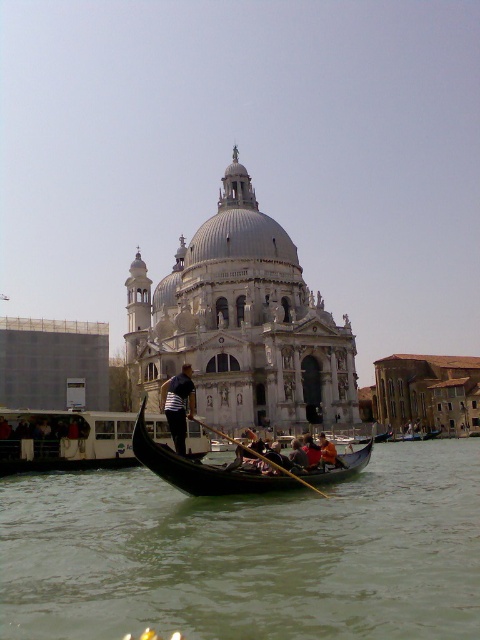
Is striped shirt at center below wooden gondola at center?

No.

Who is positioned more to the right, striped shirt at center or wooden gondola at center?

From the viewer's perspective, wooden gondola at center appears more on the right side.

Which is behind, point (180, 412) or point (423, 438)?

The point (423, 438) is behind.

This screenshot has height=640, width=480. What are the coordinates of `striped shirt at center` in the screenshot? It's located at (179, 404).

Does greenish water at gondola center appear over white marble cathedral at center?

Actually, greenish water at gondola center is below white marble cathedral at center.

Is greenish water at gondola center smaller than white marble cathedral at center?

Yes.

Which is in front, point (165, 577) or point (291, 243)?

Point (165, 577)

Image resolution: width=480 pixels, height=640 pixels. Find the location of `greenish water at gondola center`. greenish water at gondola center is located at coordinates (248, 554).

Is greenish water at gondola center smaller than striped shirt at center?

Incorrect, greenish water at gondola center is not smaller in size than striped shirt at center.

Is point (351, 540) closer to viewer compared to point (182, 442)?

That is True.

Is point (381, 554) closer to camera compared to point (164, 401)?

Yes, it is.

This screenshot has height=640, width=480. What are the coordinates of `greenish water at gondola center` in the screenshot? It's located at (248, 554).